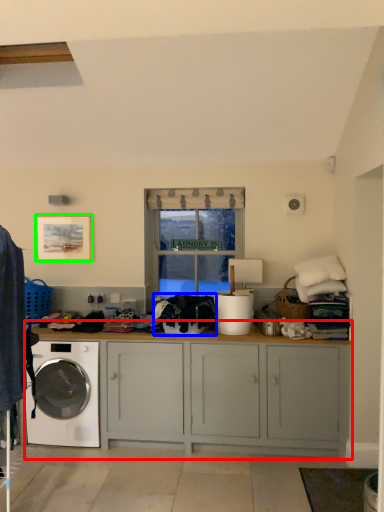
Question: Based on their relative distances, which object is farther from cabinetry (highlighted by a red box)? Choose from clothing (highlighted by a blue box) and picture frame (highlighted by a green box).

Choices:
 (A) clothing
 (B) picture frame

Answer: (B)